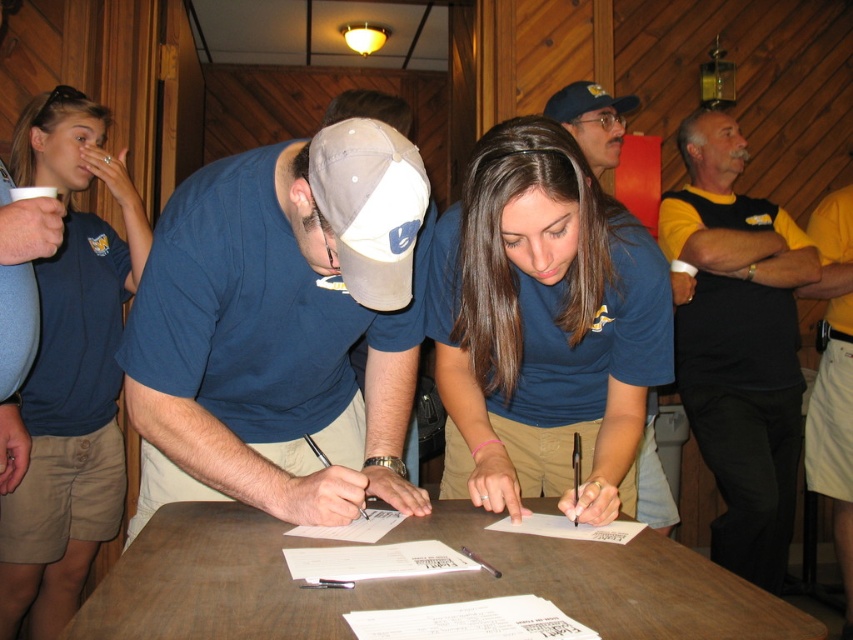
Consider the image. You are standing at the entrance of the room and want to approach the brown wooden table at center. What direction should you walk in to reach it?

The brown wooden table at center is located at the center of the room, so you should walk straight ahead from the entrance to reach it.

You are organizing a small event and need to place a 15 cm wide decorative item on the table. You have two spots available near the blue fabric shirt at center and the blue fabric baseball cap at upper center. Which spot can accommodate the item without overlapping?

The blue fabric shirt at center is wider than the blue fabric baseball cap at upper center, so the spot near the blue fabric shirt at center can accommodate the 15 cm wide decorative item without overlapping.

You are a photographer standing at the edge of the room. You want to take a photo of the blue fabric shirt at center without moving any objects. Can you reach the camera to capture the shirt in the frame?

The blue fabric shirt at center and camera are 38.85 inches apart. Since you are standing at the edge of the room, the distance between you and the shirt plus the distance from you to the camera must be considered. However, without knowing your exact position relative to both, it is impossible to determine if the camera can capture the shirt in the frame.